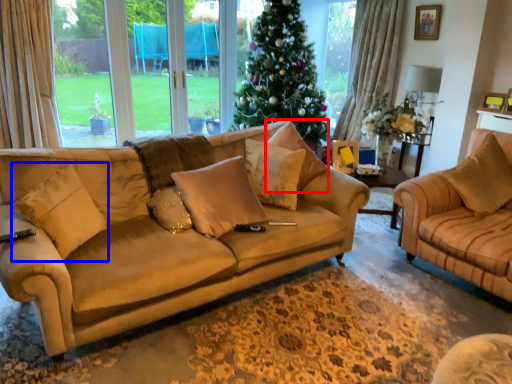
Question: Which point is closer to the camera, pillow (highlighted by a red box) or pillow (highlighted by a blue box)?

Choices:
 (A) pillow
 (B) pillow

Answer: (B)